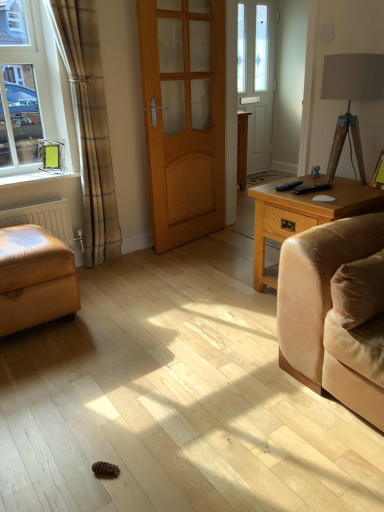
Locate an element on the screen. This screenshot has width=384, height=512. vacant region above white plastic window sill at left (from a real-world perspective) is located at coordinates (39, 168).